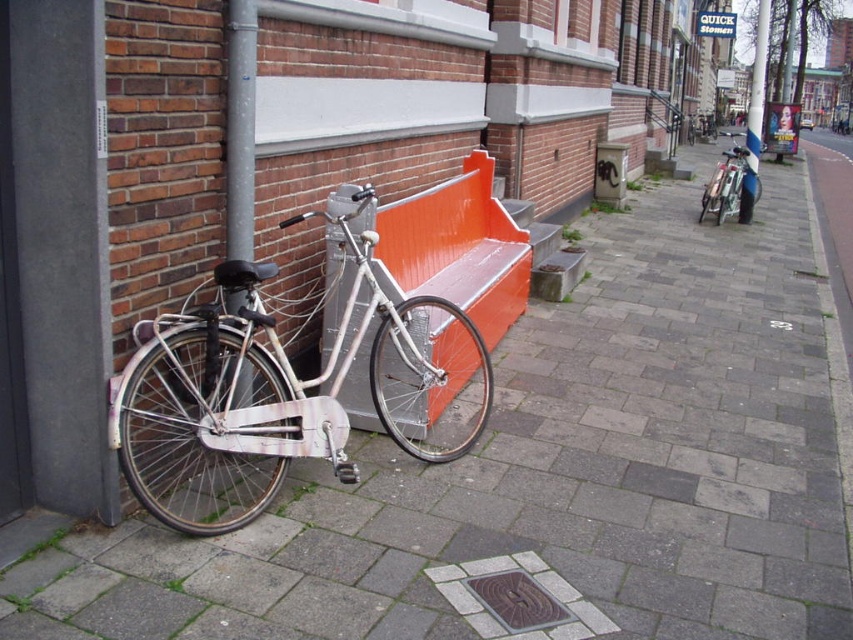
Question: Does orange glossy bench at center have a lesser width compared to shiny silver bicycle at right?

Choices:
 (A) no
 (B) yes

Answer: (B)

Question: Does white plastic pole at upper right lie in front of shiny silver bicycle at right?

Choices:
 (A) yes
 (B) no

Answer: (A)

Question: Which of the following is the farthest from the observer?

Choices:
 (A) white plastic pole at upper right
 (B) shiny silver bicycle at right
 (C) orange glossy bench at center
 (D) silver metallic bicycle at left

Answer: (B)

Question: Which is nearer to the silver metallic bicycle at left?

Choices:
 (A) shiny silver bicycle at right
 (B) orange glossy bench at center

Answer: (B)

Question: In this image, where is gray metallic pole at left located relative to white plastic pole at upper right?

Choices:
 (A) below
 (B) above

Answer: (A)

Question: Which point is farther from the camera taking this photo?

Choices:
 (A) (747, 218)
 (B) (252, 81)

Answer: (A)